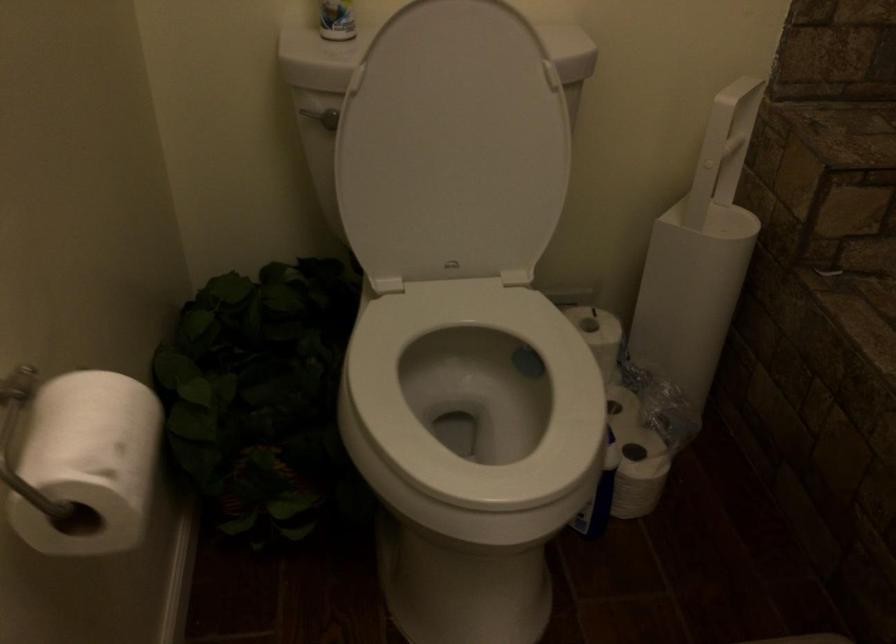
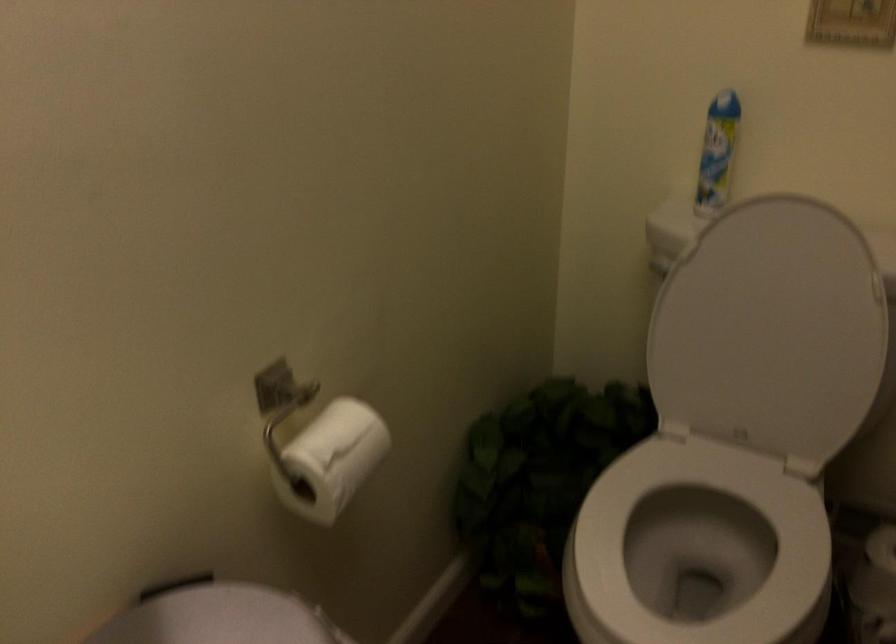
Question: The camera is either moving clockwise (left) or counter-clockwise (right) around the object. The first image is from the beginning of the video and the second image is from the end. Is the camera moving left or right when shooting the video?

Choices:
 (A) Left
 (B) Right

Answer: (B)